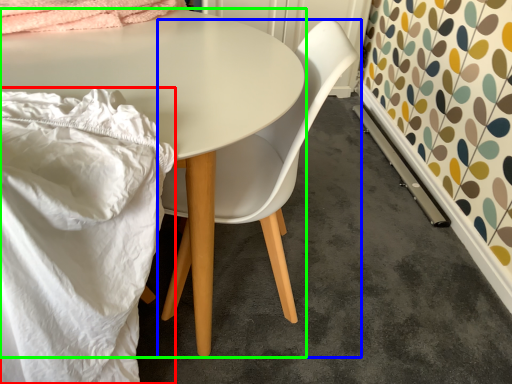
Question: Based on their relative distances, which object is farther from blanket (highlighted by a red box)? Choose from chair (highlighted by a blue box) and table (highlighted by a green box).

Choices:
 (A) chair
 (B) table

Answer: (A)